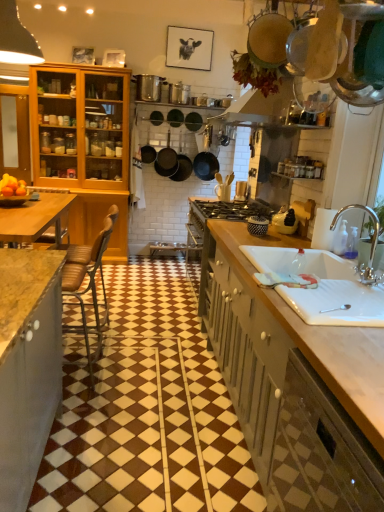
Find the location of a particular element. The height and width of the screenshot is (512, 384). vacant area that is situated to the right of brown leather chair at left is located at coordinates (151, 341).